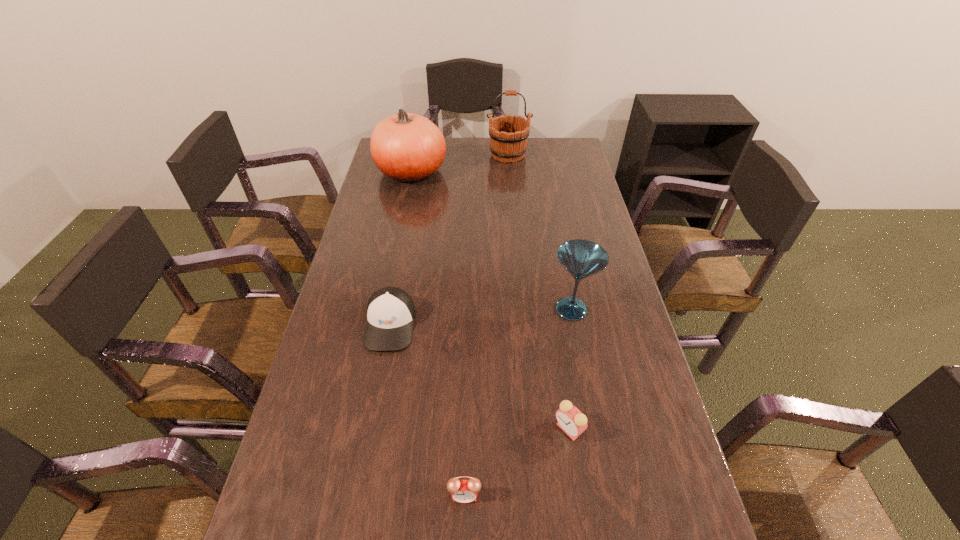
Identify the location of vacant space situated 0.210m on the front of the third tallest object. The width and height of the screenshot is (960, 540). (588, 397).

Locate an element on the screen. The width and height of the screenshot is (960, 540). blank space located 0.220m on the front panel of the cap is located at coordinates (370, 436).

This screenshot has height=540, width=960. I want to click on free location located on the face of the farther alarm clock, so click(483, 429).

Locate an element on the screen. vacant space located on the face of the farther alarm clock is located at coordinates (403, 429).

Identify the location of free spot located on the face of the farther alarm clock. Image resolution: width=960 pixels, height=540 pixels. (385, 429).

Where is `wine bucket that is at the far edge`? wine bucket that is at the far edge is located at coordinates (507, 144).

Identify the location of pumpkin located in the far edge section of the desktop. (407, 147).

This screenshot has width=960, height=540. What are the coordinates of `pumpkin that is at the left edge` in the screenshot? It's located at (407, 147).

Locate an element on the screen. cap that is positioned at the left edge is located at coordinates (391, 312).

The width and height of the screenshot is (960, 540). I want to click on object located at the right edge, so click(581, 258).